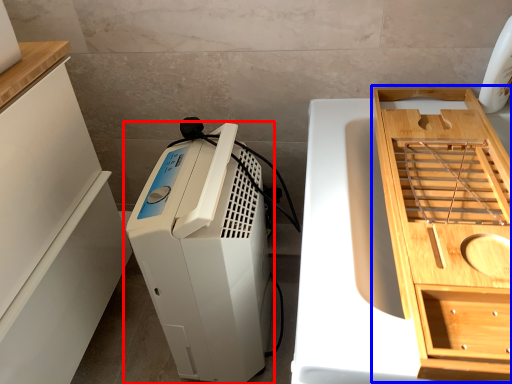
Question: Which object appears closest to the camera in this image, home appliance (highlighted by a red box) or cabinetry (highlighted by a blue box)?

Choices:
 (A) home appliance
 (B) cabinetry

Answer: (B)